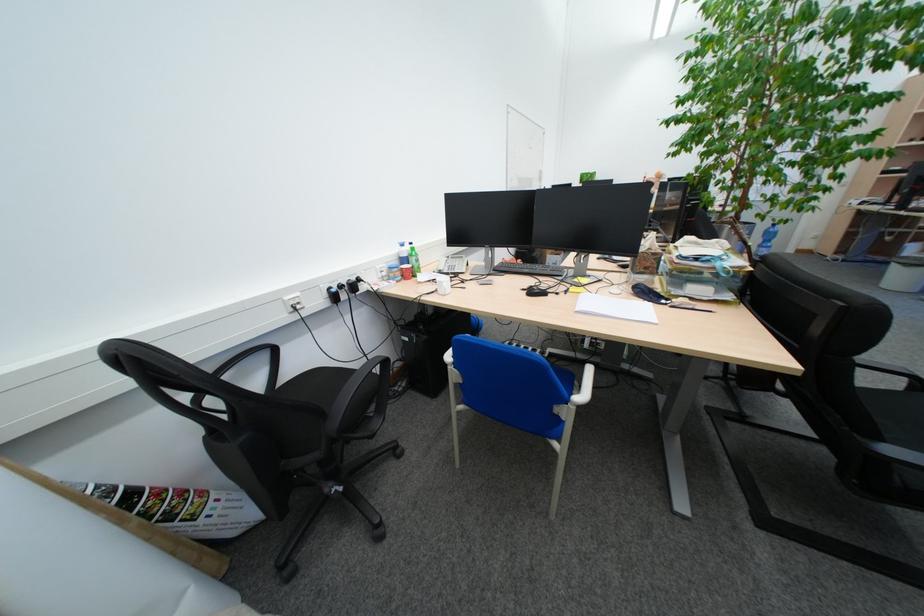
Identify the location of blue chair sitting surface. (565, 378).